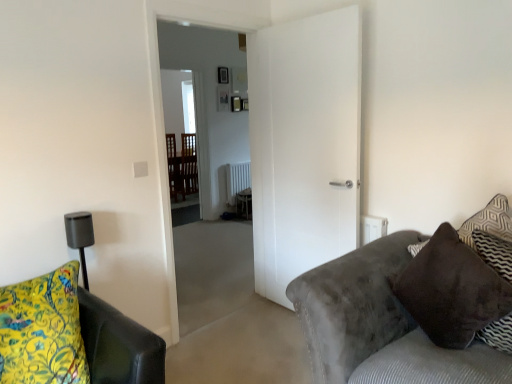
Question: From a real-world perspective, is white matte door at center physically below white painted radiator at center?

Choices:
 (A) no
 (B) yes

Answer: (A)

Question: Considering the relative positions of white matte door at center and white painted radiator at center in the image provided, is white matte door at center to the left of white painted radiator at center from the viewer's perspective?

Choices:
 (A) no
 (B) yes

Answer: (A)

Question: Is white matte door at center thinner than white painted radiator at center?

Choices:
 (A) no
 (B) yes

Answer: (B)

Question: From the image's perspective, is white matte door at center beneath white painted radiator at center?

Choices:
 (A) no
 (B) yes

Answer: (B)

Question: Could you tell me if white matte door at center is turned towards white painted radiator at center?

Choices:
 (A) yes
 (B) no

Answer: (B)

Question: From the image's perspective, is white painted radiator at center above or below white matte door at center?

Choices:
 (A) below
 (B) above

Answer: (B)

Question: In the image, is white painted radiator at center positioned in front of or behind white matte door at center?

Choices:
 (A) behind
 (B) front

Answer: (A)

Question: Is point (230, 170) positioned closer to the camera than point (269, 205)?

Choices:
 (A) farther
 (B) closer

Answer: (A)

Question: Considering the positions of white painted radiator at center and white matte door at center in the image, is white painted radiator at center taller or shorter than white matte door at center?

Choices:
 (A) tall
 (B) short

Answer: (B)

Question: Is brown suede pillow at right inside or outside of white painted radiator at center?

Choices:
 (A) inside
 (B) outside

Answer: (B)

Question: Is brown suede pillow at right bigger or smaller than white painted radiator at center?

Choices:
 (A) small
 (B) big

Answer: (B)

Question: From a real-world perspective, is brown suede pillow at right above or below white painted radiator at center?

Choices:
 (A) above
 (B) below

Answer: (A)

Question: From the image's perspective, is brown suede pillow at right positioned above or below white painted radiator at center?

Choices:
 (A) above
 (B) below

Answer: (B)

Question: From the image's perspective, is yellow floral fabric cushion at lower left above or below transparent glass door at center?

Choices:
 (A) below
 (B) above

Answer: (A)

Question: Is yellow floral fabric cushion at lower left spatially inside transparent glass door at center, or outside of it?

Choices:
 (A) inside
 (B) outside

Answer: (B)